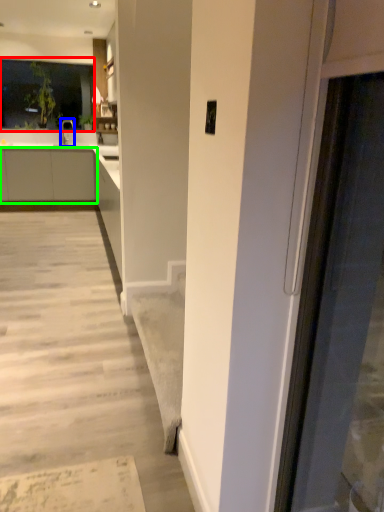
Question: Which object is positioned closest to window (highlighted by a red box)? Select from tap (highlighted by a blue box) and cabinetry (highlighted by a green box).

Choices:
 (A) tap
 (B) cabinetry

Answer: (A)